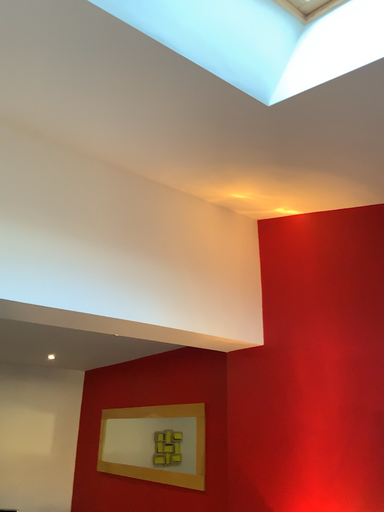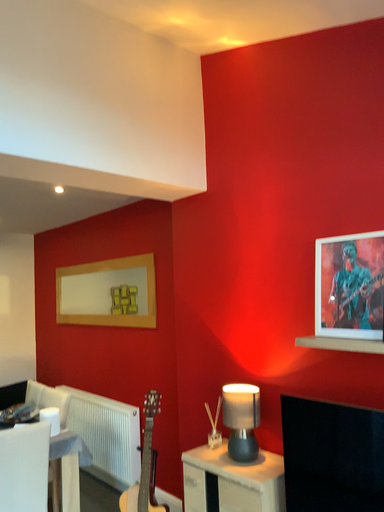
Question: Which way did the camera rotate in the video?

Choices:
 (A) rotated right
 (B) rotated left

Answer: (A)